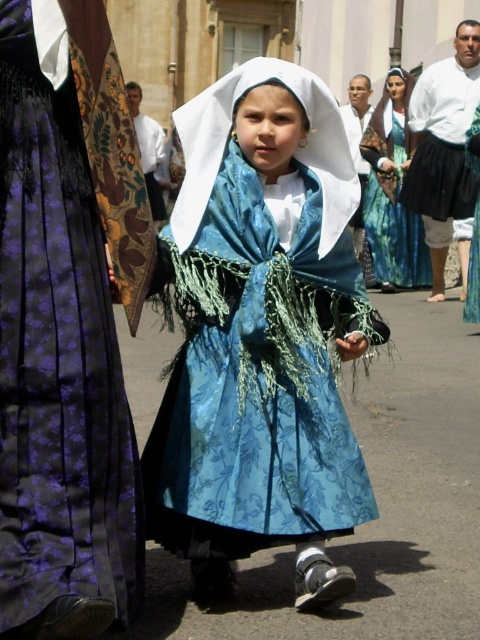
You are a photographer at the event and want to capture both the white fabric headdress at center and the blue silk dress at center in a single frame. Given that your camera has a maximum zoom range of 50 feet, can you fit both objects into the frame without moving closer?

The white fabric headdress at center and blue silk dress at center are 51.36 feet apart from each other, which exceeds the camera maximum zoom range of 50 feet. Therefore, you cannot fit both objects into the frame without moving closer.

You are a photographer trying to capture the central figure in the scene. The blue fabric dress at center and the white fabric headdress at center are both important elements. Which one should you focus on first if you want to ensure both are in frame without moving the camera?

The blue fabric dress at center is below the white fabric headdress at center, so focusing on the headdress first will allow the dress to naturally fall into the frame below it without needing to adjust the camera position.

You are a photographer at the event and want to capture both the white fabric headdress at center and the blue silk dress at center in a single frame. Which object should you focus on first to ensure both are in the frame?

The white fabric headdress at center has a smaller size compared to the blue silk dress at center, so you should focus on the white fabric headdress at center first to ensure both are in the frame.